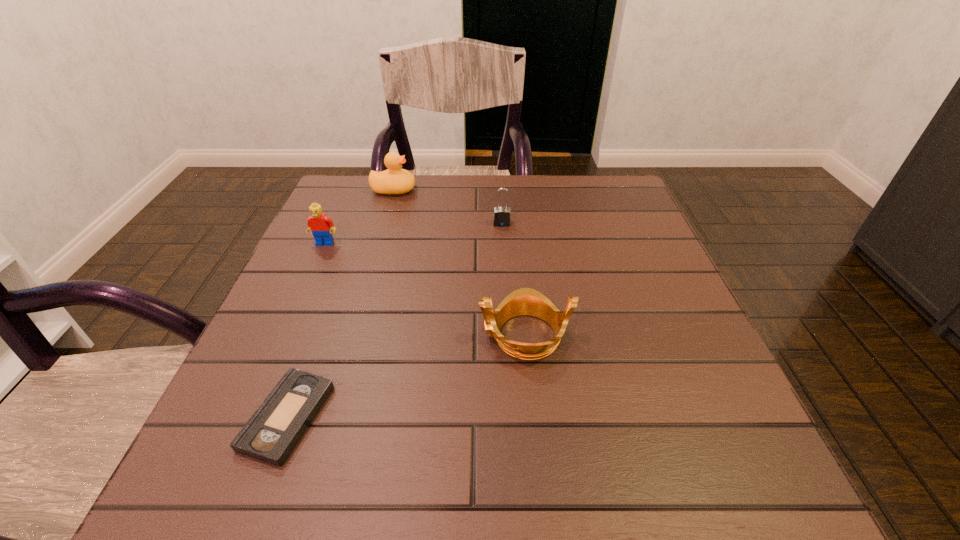
I want to click on vacant space that satisfies the following two spatial constraints: 1. on the face of the farthest object; 2. on the face of the Lego, so click(378, 243).

This screenshot has height=540, width=960. What are the coordinates of `vacant space that satisfies the following two spatial constraints: 1. on the face of the farthest object; 2. on the face of the third farthest object` in the screenshot? It's located at (378, 243).